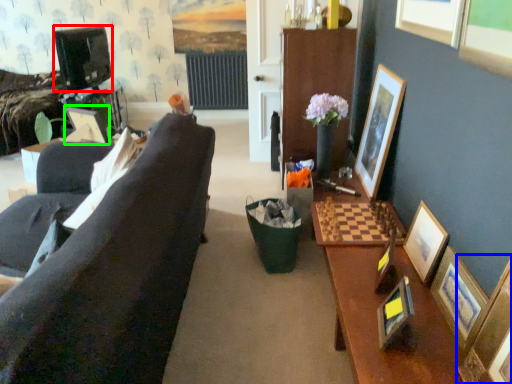
Question: Which object is positioned farthest from television (highlighted by a red box)? Select from picture frame (highlighted by a blue box) and picture frame (highlighted by a green box).

Choices:
 (A) picture frame
 (B) picture frame

Answer: (A)